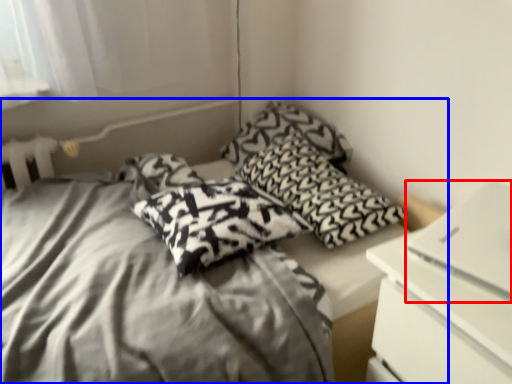
Question: Which of the following is the farthest to the observer, computer (highlighted by a red box) or bed (highlighted by a blue box)?

Choices:
 (A) computer
 (B) bed

Answer: (A)